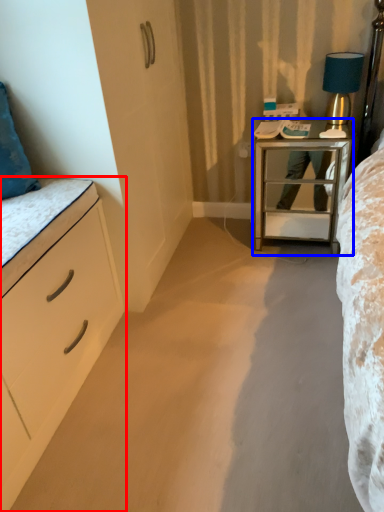
Question: Which object appears farthest to the camera in this image, chest of drawers (highlighted by a red box) or nightstand (highlighted by a blue box)?

Choices:
 (A) chest of drawers
 (B) nightstand

Answer: (B)